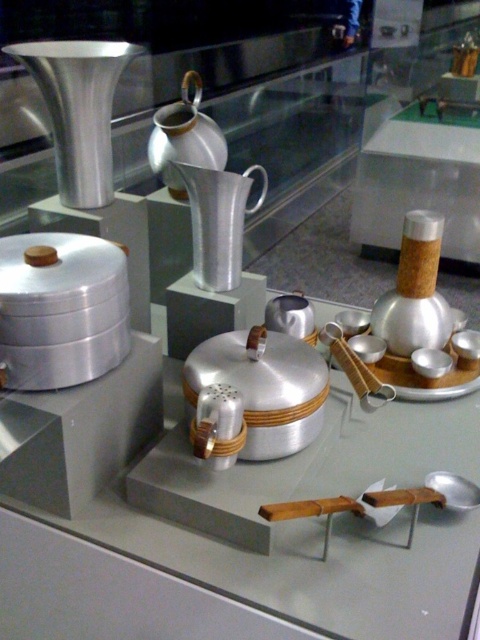
You are a museum curator arranging an exhibition. You need to place a decorative centerpiece on the shelf where the silver metallic pitcher at center and polished silver teapot at center are displayed. Where should you place the centerpiece so it doesn

The silver metallic pitcher at center is located below the polished silver teapot at center. To place the centerpiece appropriately, it should be positioned above the silver metallic pitcher at center and below the polished silver teapot at center to maintain the vertical arrangement.

You are a museum curator planning to display both the silver metallic pitcher at center and the polished silver teapot at center on a shelf. If you want to place them side by side, which one should you position first to ensure the taller item is on the left?

The polished silver teapot at center is taller than the silver metallic pitcher at center, so you should place the polished silver teapot at center first on the left to have the taller item on the left.